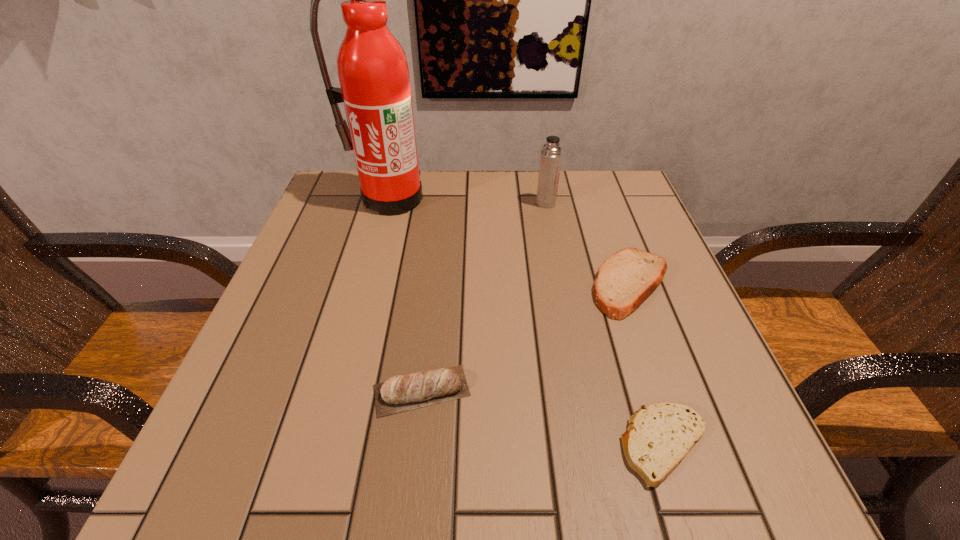
Where is `fire extinguisher`? Image resolution: width=960 pixels, height=540 pixels. fire extinguisher is located at coordinates (373, 73).

You are a GUI agent. You are given a task and a screenshot of the screen. Output one action in this format:
    pyautogui.click(x=<x>, y=<y>)
    Task: Click on the thermos bottle
    
    Given the screenshot: What is the action you would take?
    pyautogui.click(x=551, y=156)

Find the location of `the fourth shortest object`. the fourth shortest object is located at coordinates (551, 156).

Locate an element on the screen. Image resolution: width=960 pixels, height=540 pixels. the farthest pita bread is located at coordinates (625, 279).

At what (x,y) coordinates should I click in order to perform the action: click on the leftmost pita bread. Please return your answer as a coordinate pair (x, y). This screenshot has height=540, width=960. Looking at the image, I should click on (400, 393).

The width and height of the screenshot is (960, 540). I want to click on the shortest object, so click(660, 435).

At what (x,y) coordinates should I click in order to perform the action: click on vacant space located 0.330m on the label side of the tallest object. Please return your answer as a coordinate pair (x, y). Looking at the image, I should click on (356, 324).

Identify the location of vacant space situated 0.330m on the front of the third object from left to right. This screenshot has width=960, height=540. (567, 311).

You are a GUI agent. You are given a task and a screenshot of the screen. Output one action in this format:
    pyautogui.click(x=<x>, y=<y>)
    Task: Click on the vacant area situated on the front of the farthest pita bread
    This screenshot has width=960, height=540.
    Given the screenshot: What is the action you would take?
    pyautogui.click(x=685, y=437)

Identify the location of free space located on the right of the leftmost pita bread. This screenshot has height=540, width=960. (593, 390).